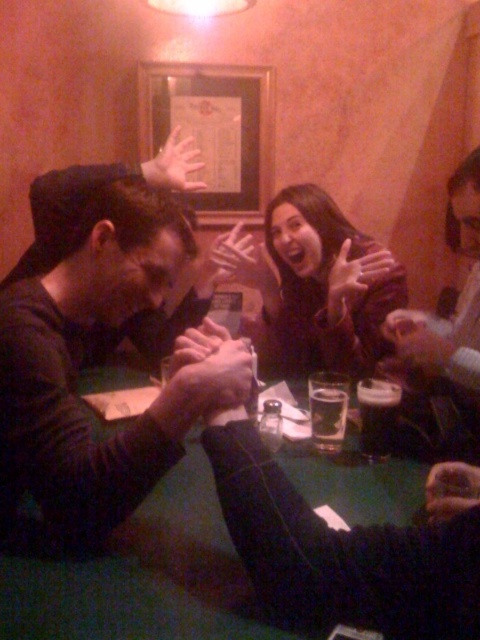
You are a bartender preparing to serve drinks to two customers seated at the green table. You need to place a tray between the matte black shirt at left and the smooth skin hand at center. The tray is 8 inches wide. Will it fit without overlapping either object?

The distance between the matte black shirt at left and the smooth skin hand at center is 7.29 inches. Since the tray is 8 inches wide, it will not fit as it is wider than the available space between them.

You are a photographer positioned behind the two people at the green table. You want to capture a closeup shot of the matte black shirt at left and the dark brown hair at center. Given that your camera has a minimum focusing distance of 20 inches, will you be able to take the photo without moving closer?

The matte black shirt at left is 21.54 inches from the dark brown hair at center. Since the minimum focusing distance is 20 inches, the photographer can take the photo without moving closer as the distance between them is within the camera capability.

You are a photographer standing at the back of the bar. You want to take a photo of the matte black shirt at left and dark brown hair at center. Which object is closer to your camera lens?

The matte black shirt at left is closer to the viewer than dark brown hair at center, so the matte black shirt at left will appear closer in the photo.